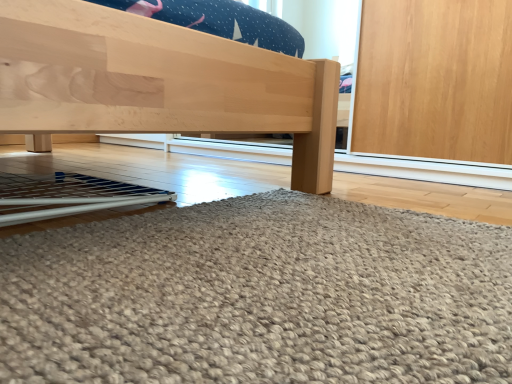
Question: From the image's perspective, is wooden door at lower right below natural wood bed frame at center?

Choices:
 (A) no
 (B) yes

Answer: (B)

Question: From a real-world perspective, is wooden door at lower right positioned under natural wood bed frame at center based on gravity?

Choices:
 (A) no
 (B) yes

Answer: (B)

Question: From a real-world perspective, is wooden door at lower right positioned over natural wood bed frame at center based on gravity?

Choices:
 (A) no
 (B) yes

Answer: (A)

Question: Considering the relative sizes of wooden door at lower right and natural wood bed frame at center in the image provided, is wooden door at lower right taller than natural wood bed frame at center?

Choices:
 (A) no
 (B) yes

Answer: (A)

Question: Is wooden door at lower right closer to the viewer compared to natural wood bed frame at center?

Choices:
 (A) yes
 (B) no

Answer: (A)

Question: Does wooden door at lower right appear on the right side of natural wood bed frame at center?

Choices:
 (A) no
 (B) yes

Answer: (B)

Question: Is natural wood bed frame at center behind wooden door at lower right?

Choices:
 (A) yes
 (B) no

Answer: (A)

Question: From a real-world perspective, is natural wood bed frame at center on top of wooden door at lower right?

Choices:
 (A) yes
 (B) no

Answer: (A)

Question: Does natural wood bed frame at center have a lesser width compared to wooden door at lower right?

Choices:
 (A) yes
 (B) no

Answer: (B)

Question: Is natural wood bed frame at center closer to camera compared to wooden door at lower right?

Choices:
 (A) yes
 (B) no

Answer: (B)

Question: Would you say natural wood bed frame at center is a long distance from wooden door at lower right?

Choices:
 (A) no
 (B) yes

Answer: (A)

Question: Considering the relative sizes of natural wood bed frame at center and wooden door at lower right in the image provided, is natural wood bed frame at center smaller than wooden door at lower right?

Choices:
 (A) yes
 (B) no

Answer: (B)

Question: Is point (314, 274) closer or farther from the camera than point (5, 13)?

Choices:
 (A) farther
 (B) closer

Answer: (A)